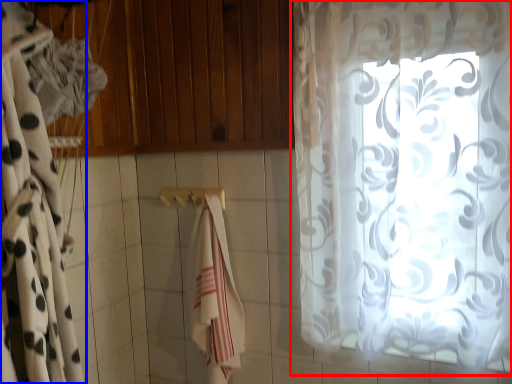
Question: Which object is further to the camera taking this photo, curtain (highlighted by a red box) or curtain (highlighted by a blue box)?

Choices:
 (A) curtain
 (B) curtain

Answer: (A)